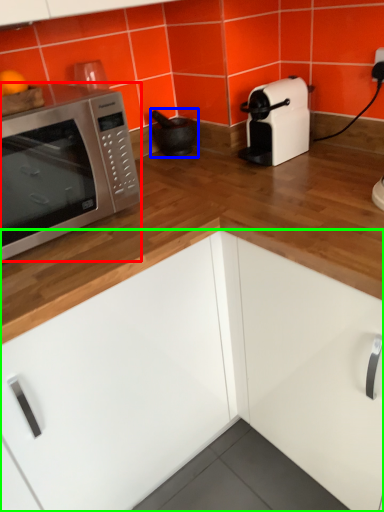
Question: Which object is the farthest from microwave oven (highlighted by a red box)? Choose among these: appliance (highlighted by a blue box) or cabinetry (highlighted by a green box).

Choices:
 (A) appliance
 (B) cabinetry

Answer: (A)